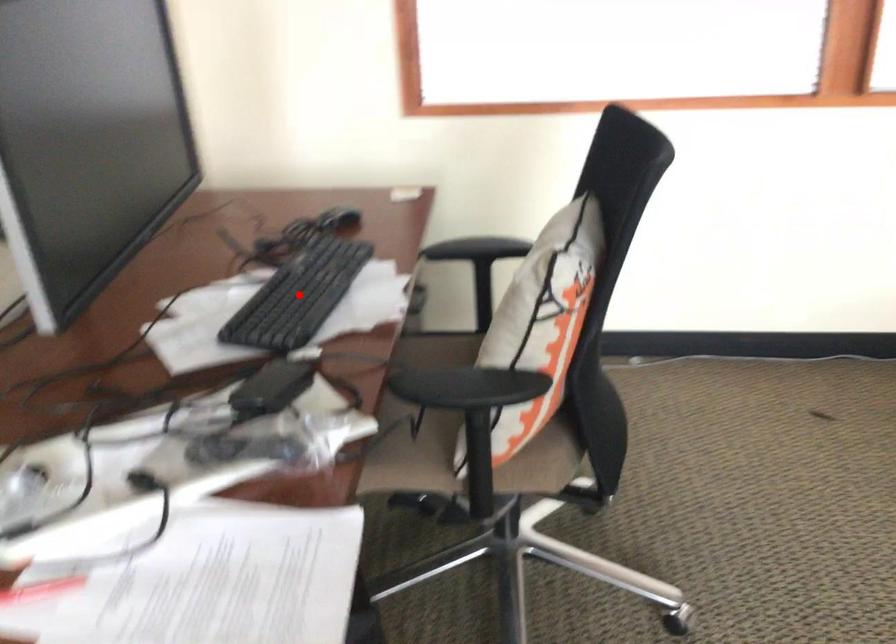
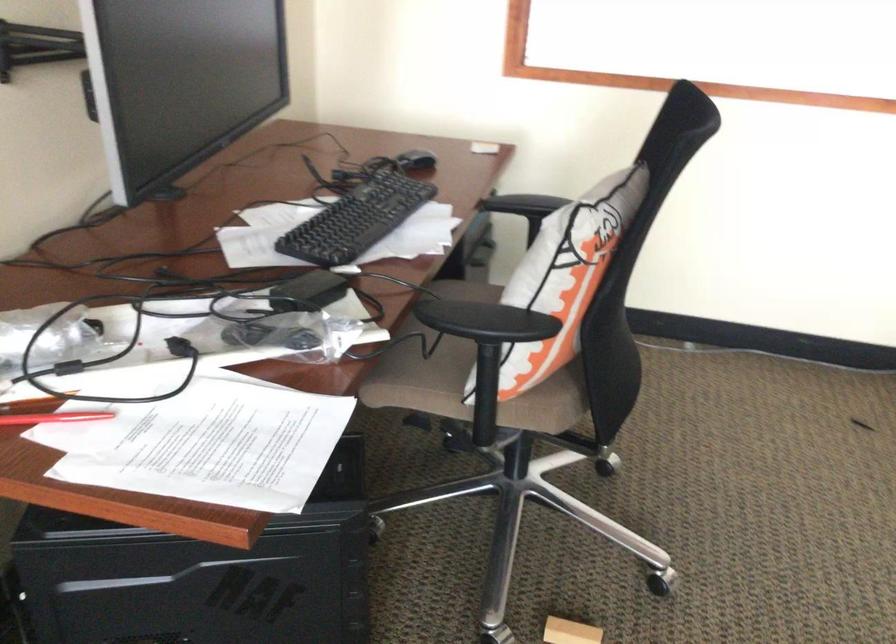
Locate, in the second image, the point that corresponds to the highlighted location in the first image.

(356, 220)